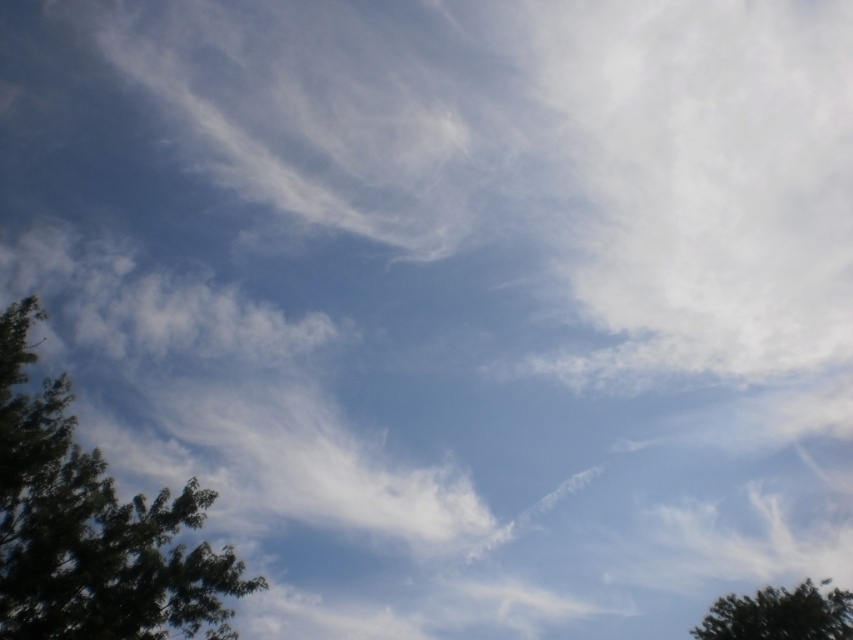
Locate an element on the screen. The image size is (853, 640). green leafy tree at left is located at coordinates (91, 528).

Can you confirm if green leafy tree at left is taller than green leafy tree at lower right?

No, green leafy tree at left is not taller than green leafy tree at lower right.

Where is `green leafy tree at left`? This screenshot has height=640, width=853. green leafy tree at left is located at coordinates (91, 528).

Find the location of a particular element. Image resolution: width=853 pixels, height=640 pixels. green leafy tree at left is located at coordinates (91, 528).